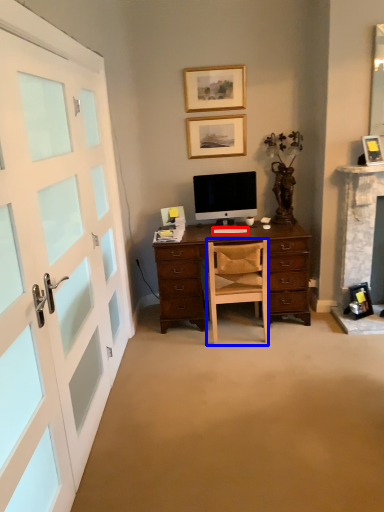
Question: Which point is further to the camera, computer keyboard (highlighted by a red box) or chair (highlighted by a blue box)?

Choices:
 (A) computer keyboard
 (B) chair

Answer: (A)